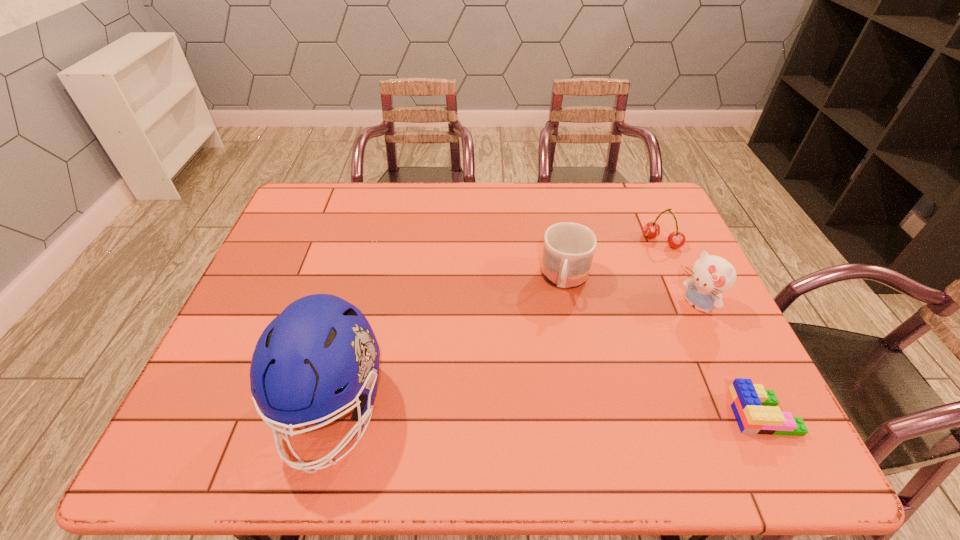
Where is `vacant space on the desktop that is between the football helmet and the shortest object and is positioned with stems pointing upwards on the farthest object`? This screenshot has width=960, height=540. vacant space on the desktop that is between the football helmet and the shortest object and is positioned with stems pointing upwards on the farthest object is located at coordinates (527, 411).

The image size is (960, 540). In order to click on free spot on the desktop that is between the leftmost object and the Lego and is positioned on the side with the handle of the mug in this screenshot , I will do `click(540, 411)`.

Identify the location of free space on the desktop that is between the tallest object and the shortest object and is positioned on the front-facing side of the fourth shortest object. The height and width of the screenshot is (540, 960). (554, 411).